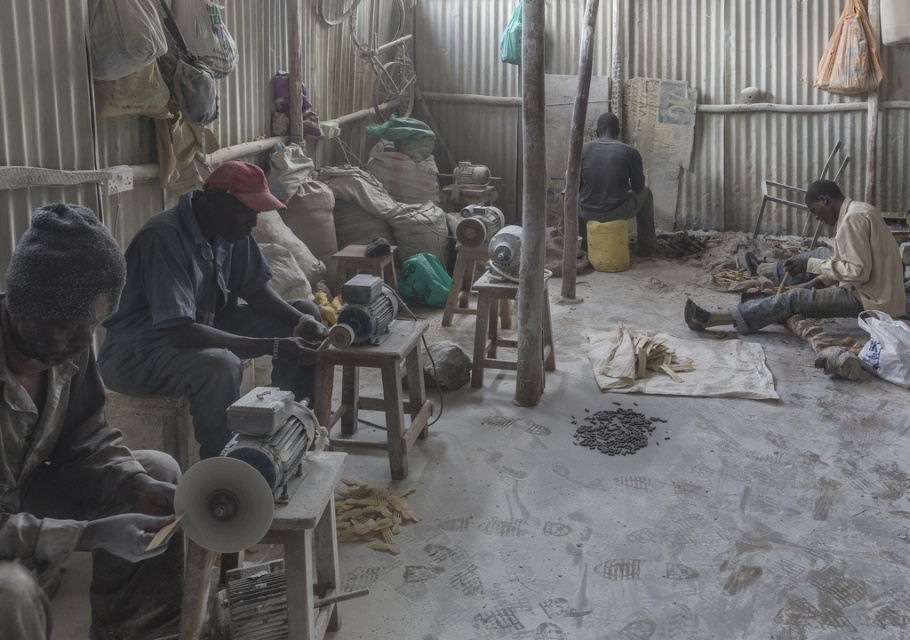
Question: Which point is closer to the camera?

Choices:
 (A) dark gray fabric at left
 (B) wooden stool at center
 (C) light beige fabric at lower right

Answer: (A)

Question: Among these objects, which one is farthest from the camera?

Choices:
 (A) wooden stool at center
 (B) light beige fabric at lower right
 (C) blue denim shirt at center
 (D) dark gray fabric at left

Answer: (B)

Question: Does light beige fabric at lower right appear on the left side of dark gray fabric at center?

Choices:
 (A) no
 (B) yes

Answer: (A)

Question: Among these objects, which one is farthest from the camera?

Choices:
 (A) wooden stool at center
 (B) light beige fabric at lower right

Answer: (B)

Question: Is blue denim shirt at center further to camera compared to dark gray fabric at center?

Choices:
 (A) yes
 (B) no

Answer: (B)

Question: Does light beige fabric at lower right appear under wooden stool at center?

Choices:
 (A) yes
 (B) no

Answer: (B)